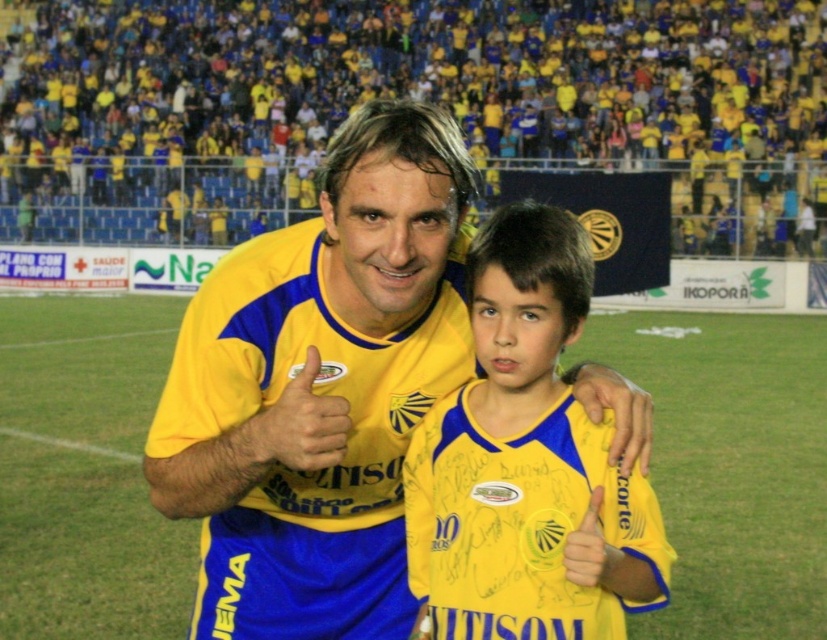
Describe the element at coordinates (422, 77) in the screenshot. I see `yellow matte jersey at center` at that location.

From the picture: Which is below, yellow matte jersey at center or yellow jersey at center?

yellow jersey at center is lower down.

The height and width of the screenshot is (640, 827). In order to click on yellow matte jersey at center in this screenshot , I will do `click(422, 77)`.

Identify the location of yellow matte jersey at center. (422, 77).